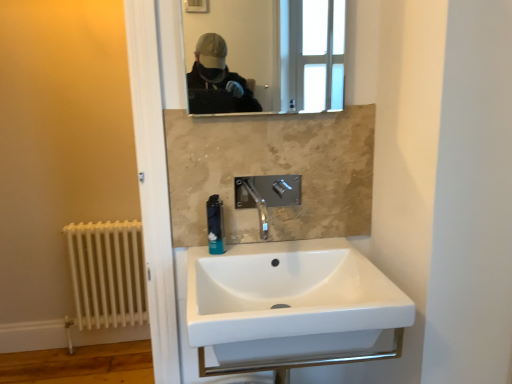
Question: Is blue plastic soap dispenser at center closer to the viewer compared to white painted metal radiator at lower left?

Choices:
 (A) no
 (B) yes

Answer: (B)

Question: Can you confirm if blue plastic soap dispenser at center is wider than white painted metal radiator at lower left?

Choices:
 (A) yes
 (B) no

Answer: (B)

Question: Considering the relative sizes of blue plastic soap dispenser at center and white painted metal radiator at lower left in the image provided, is blue plastic soap dispenser at center bigger than white painted metal radiator at lower left?

Choices:
 (A) yes
 (B) no

Answer: (B)

Question: Does blue plastic soap dispenser at center touch white painted metal radiator at lower left?

Choices:
 (A) no
 (B) yes

Answer: (A)

Question: From a real-world perspective, is blue plastic soap dispenser at center on white painted metal radiator at lower left?

Choices:
 (A) no
 (B) yes

Answer: (B)

Question: Is blue plastic soap dispenser at center smaller than white painted metal radiator at lower left?

Choices:
 (A) no
 (B) yes

Answer: (B)

Question: Is blue plastic soap dispenser at center at the right side of white ceramic sink at center?

Choices:
 (A) yes
 (B) no

Answer: (B)

Question: Does blue plastic soap dispenser at center come behind white ceramic sink at center?

Choices:
 (A) yes
 (B) no

Answer: (A)

Question: Is blue plastic soap dispenser at center facing away from white ceramic sink at center?

Choices:
 (A) yes
 (B) no

Answer: (B)

Question: Does blue plastic soap dispenser at center lie in front of white ceramic sink at center?

Choices:
 (A) yes
 (B) no

Answer: (B)

Question: From the image's perspective, is blue plastic soap dispenser at center on white ceramic sink at center?

Choices:
 (A) yes
 (B) no

Answer: (A)

Question: From a real-world perspective, is blue plastic soap dispenser at center physically below white ceramic sink at center?

Choices:
 (A) yes
 (B) no

Answer: (B)

Question: From a real-world perspective, is white ceramic sink at center located higher than white painted metal radiator at lower left?

Choices:
 (A) no
 (B) yes

Answer: (B)